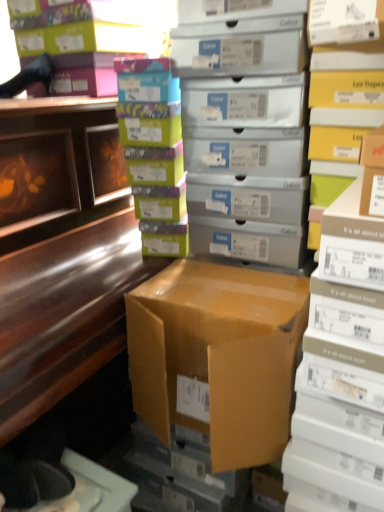
Describe the element at coordinates (218, 356) in the screenshot. I see `brown cardboard box at center` at that location.

This screenshot has height=512, width=384. Describe the element at coordinates (341, 369) in the screenshot. I see `matte cardboard box at right, marked as the first book in a bottom-to-top arrangement` at that location.

The image size is (384, 512). Describe the element at coordinates (245, 126) in the screenshot. I see `matte silver shoebox at center, which appears as the first shelf when viewed from the left` at that location.

This screenshot has width=384, height=512. In order to click on matte silver shoebox at center, positioned as the second shelf in right-to-left order in this screenshot , I will do `click(245, 126)`.

The height and width of the screenshot is (512, 384). Find the location of `yellow cardboard box at right, the 2th shelf positioned from the left`. yellow cardboard box at right, the 2th shelf positioned from the left is located at coordinates pos(343,90).

Is matte cardboard box at right, marked as the first book in a bottom-to-top arrangement, to the right of matte silver shoebox at center, positioned as the second shelf in right-to-left order, from the viewer's perspective?

Correct, you'll find matte cardboard box at right, marked as the first book in a bottom-to-top arrangement, to the right of matte silver shoebox at center, positioned as the second shelf in right-to-left order.

How distant is matte cardboard box at right, positioned as the second book in top-to-bottom order, from matte silver shoebox at center, which appears as the first shelf when viewed from the left?

matte cardboard box at right, positioned as the second book in top-to-bottom order, and matte silver shoebox at center, which appears as the first shelf when viewed from the left, are 43.10 centimeters apart from each other.

Is matte cardboard box at right, the second book viewed from the left, next to matte silver shoebox at center, which appears as the first shelf when viewed from the left?

No, matte cardboard box at right, the second book viewed from the left, is not making contact with matte silver shoebox at center, which appears as the first shelf when viewed from the left.

Is the position of matte cardboard box at right, the 1th book from the right, more distant than that of matte silver shoebox at center, which appears as the first shelf when viewed from the left?

No, it is not.

In terms of width, does matte silver shoebox at center, which appears as the first shelf when viewed from the left, look wider or thinner when compared to multicolored cardboard boxes at center, marked as the second book in a bottom-to-top arrangement?

matte silver shoebox at center, which appears as the first shelf when viewed from the left, is wider than multicolored cardboard boxes at center, marked as the second book in a bottom-to-top arrangement.

From a real-world perspective, between matte silver shoebox at center, positioned as the second shelf in right-to-left order, and multicolored cardboard boxes at center, acting as the first book starting from the top, who is vertically higher?

matte silver shoebox at center, positioned as the second shelf in right-to-left order, is physically above.

You are a GUI agent. You are given a task and a screenshot of the screen. Output one action in this format:
    pyautogui.click(x=<x>, y=<y>)
    Task: Click on the 1st book below the matte silver shoebox at center, which appears as the first shelf when viewed from the left (from a real-world perspective)
    
    Given the screenshot: What is the action you would take?
    pyautogui.click(x=154, y=152)

Considering the positions of objects matte silver shoebox at center, positioned as the second shelf in right-to-left order, and multicolored cardboard boxes at center, positioned as the first book in left-to-right order, in the image provided, who is behind, matte silver shoebox at center, positioned as the second shelf in right-to-left order, or multicolored cardboard boxes at center, positioned as the first book in left-to-right order,?

multicolored cardboard boxes at center, positioned as the first book in left-to-right order, is more distant.

Is yellow cardboard box at right, the 2th shelf positioned from the left, wider or thinner than matte cardboard box at right, the second book viewed from the left?

yellow cardboard box at right, the 2th shelf positioned from the left, is thinner than matte cardboard box at right, the second book viewed from the left.

From the image's perspective, is yellow cardboard box at right, arranged as the first shelf when viewed from the right, located above or below matte cardboard box at right, positioned as the second book in top-to-bottom order?

yellow cardboard box at right, arranged as the first shelf when viewed from the right, is above matte cardboard box at right, positioned as the second book in top-to-bottom order.

At what (x,y) coordinates should I click in order to perform the action: click on book in front of the yellow cardboard box at right, arranged as the first shelf when viewed from the right. Please return your answer as a coordinate pair (x, y). The image size is (384, 512). Looking at the image, I should click on (341, 369).

Is shiny brown desk at left positioned beyond the bounds of brown cardboard box at center?

shiny brown desk at left lies outside brown cardboard box at center's area.

How distant is shiny brown desk at left from brown cardboard box at center?

A distance of 10.09 inches exists between shiny brown desk at left and brown cardboard box at center.

Which is behind, point (95, 245) or point (148, 392)?

Point (95, 245)

From a real-world perspective, which is physically above, shiny brown desk at left or brown cardboard box at center?

From a 3D spatial view, shiny brown desk at left is above.

Considering the sizes of shiny brown desk at left and yellow cardboard box at right, arranged as the first shelf when viewed from the right, in the image, is shiny brown desk at left bigger or smaller than yellow cardboard box at right, arranged as the first shelf when viewed from the right,?

Considering their sizes, shiny brown desk at left takes up more space than yellow cardboard box at right, arranged as the first shelf when viewed from the right.

Considering the positions of point (54, 335) and point (338, 154), is point (54, 335) closer or farther from the camera than point (338, 154)?

Clearly, point (54, 335) is closer to the camera than point (338, 154).

In the image, there is a yellow cardboard box at right, the 2th shelf positioned from the left. At what (x,y) coordinates should I click in order to perform the action: click on desk below it (from a real-world perspective). Please return your answer as a coordinate pair (x, y). This screenshot has height=512, width=384. Looking at the image, I should click on (63, 275).

From a real-world perspective, relative to brown cardboard box at center, is matte cardboard box at right, the 1th book from the right, vertically above or below?

Clearly, from a real-world perspective, matte cardboard box at right, the 1th book from the right, is below brown cardboard box at center.

Considering the relative sizes of matte cardboard box at right, positioned as the second book in top-to-bottom order, and brown cardboard box at center in the image provided, is matte cardboard box at right, positioned as the second book in top-to-bottom order, bigger than brown cardboard box at center?

Indeed, matte cardboard box at right, positioned as the second book in top-to-bottom order, has a larger size compared to brown cardboard box at center.

Is matte cardboard box at right, positioned as the second book in top-to-bottom order, oriented towards brown cardboard box at center?

No, matte cardboard box at right, positioned as the second book in top-to-bottom order, is not turned towards brown cardboard box at center.

Who is smaller, matte cardboard box at right, positioned as the second book in top-to-bottom order, or yellow cardboard box at right, arranged as the first shelf when viewed from the right?

With smaller size is yellow cardboard box at right, arranged as the first shelf when viewed from the right.

Choose the correct answer: Is matte cardboard box at right, the 1th book from the right, inside yellow cardboard box at right, arranged as the first shelf when viewed from the right, or outside it?

The correct answer is: outside.

Is the surface of matte cardboard box at right, positioned as the second book in top-to-bottom order, in direct contact with yellow cardboard box at right, arranged as the first shelf when viewed from the right?

No, matte cardboard box at right, positioned as the second book in top-to-bottom order, is not in contact with yellow cardboard box at right, arranged as the first shelf when viewed from the right.

I want to click on book on the right of matte silver shoebox at center, positioned as the second shelf in right-to-left order, so click(341, 369).

Identify the location of shelf that is the 2nd object above the multicolored cardboard boxes at center, marked as the second book in a bottom-to-top arrangement (from a real-world perspective). This screenshot has width=384, height=512. (245, 126).

From the picture: Considering their positions, is brown cardboard box at center positioned closer to matte silver shoebox at center, positioned as the second shelf in right-to-left order, than multicolored cardboard boxes at center, acting as the first book starting from the top?

The object closer to matte silver shoebox at center, positioned as the second shelf in right-to-left order, is multicolored cardboard boxes at center, acting as the first book starting from the top.

Considering their positions, is yellow cardboard box at right, arranged as the first shelf when viewed from the right, positioned further to matte silver shoebox at center, positioned as the second shelf in right-to-left order, than shiny brown desk at left?

Based on the image, shiny brown desk at left appears to be further to matte silver shoebox at center, positioned as the second shelf in right-to-left order.

When comparing their distances from matte cardboard box at right, marked as the first book in a bottom-to-top arrangement, does multicolored cardboard boxes at center, marked as the second book in a bottom-to-top arrangement, or shiny brown desk at left seem further?

Based on the image, shiny brown desk at left appears to be further to matte cardboard box at right, marked as the first book in a bottom-to-top arrangement.

Based on their spatial positions, is shiny brown desk at left or yellow cardboard box at right, arranged as the first shelf when viewed from the right, closer to matte silver shoebox at center, positioned as the second shelf in right-to-left order?

Among the two, yellow cardboard box at right, arranged as the first shelf when viewed from the right, is located nearer to matte silver shoebox at center, positioned as the second shelf in right-to-left order.

Looking at this image, based on their spatial positions, is yellow cardboard box at right, arranged as the first shelf when viewed from the right, or matte silver shoebox at center, which appears as the first shelf when viewed from the left, closer to multicolored cardboard boxes at center, positioned as the first book in left-to-right order?

matte silver shoebox at center, which appears as the first shelf when viewed from the left, lies closer to multicolored cardboard boxes at center, positioned as the first book in left-to-right order, than the other object.

Consider the image. When comparing their distances from matte cardboard box at right, positioned as the second book in top-to-bottom order, does multicolored cardboard boxes at center, marked as the second book in a bottom-to-top arrangement, or yellow cardboard box at right, arranged as the first shelf when viewed from the right, seem closer?

yellow cardboard box at right, arranged as the first shelf when viewed from the right, lies closer to matte cardboard box at right, positioned as the second book in top-to-bottom order, than the other object.

Which object lies further to the anchor point yellow cardboard box at right, arranged as the first shelf when viewed from the right, brown cardboard box at center or matte cardboard box at right, marked as the first book in a bottom-to-top arrangement?

brown cardboard box at center is further to yellow cardboard box at right, arranged as the first shelf when viewed from the right.

Considering their positions, is yellow cardboard box at right, arranged as the first shelf when viewed from the right, positioned closer to matte cardboard box at right, marked as the first book in a bottom-to-top arrangement, than brown cardboard box at center?

brown cardboard box at center lies closer to matte cardboard box at right, marked as the first book in a bottom-to-top arrangement, than the other object.

This screenshot has height=512, width=384. Find the location of `shelf between matte silver shoebox at center, which appears as the first shelf when viewed from the left, and brown cardboard box at center from top to bottom`. shelf between matte silver shoebox at center, which appears as the first shelf when viewed from the left, and brown cardboard box at center from top to bottom is located at coordinates (343, 90).

Locate an element on the screen. desk that lies between matte silver shoebox at center, which appears as the first shelf when viewed from the left, and brown cardboard box at center from top to bottom is located at coordinates (63, 275).

The image size is (384, 512). In order to click on book between matte silver shoebox at center, which appears as the first shelf when viewed from the left, and brown cardboard box at center from top to bottom in this screenshot , I will do `click(154, 152)`.

Where is `book between matte silver shoebox at center, positioned as the second shelf in right-to-left order, and matte cardboard box at right, marked as the first book in a bottom-to-top arrangement, vertically`? book between matte silver shoebox at center, positioned as the second shelf in right-to-left order, and matte cardboard box at right, marked as the first book in a bottom-to-top arrangement, vertically is located at coordinates (154, 152).